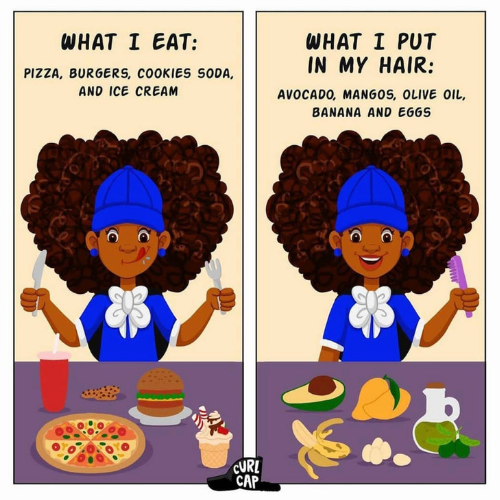
This screenshot has height=500, width=500. In order to click on fork held by woman's left hand in this screenshot , I will do `click(215, 272)`.